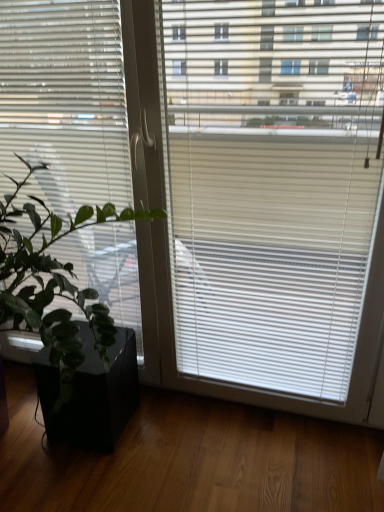
Where is `vacant area that is situated to the right of black matte flowerpot at lower left`? The width and height of the screenshot is (384, 512). vacant area that is situated to the right of black matte flowerpot at lower left is located at coordinates (172, 430).